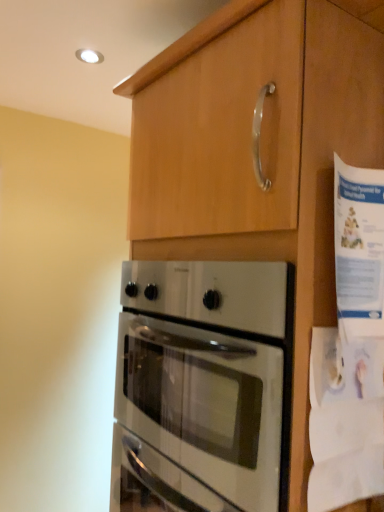
This screenshot has width=384, height=512. In order to click on white paper at right in this screenshot , I will do `click(351, 352)`.

This screenshot has height=512, width=384. What do you see at coordinates (261, 152) in the screenshot?
I see `matte wood cabinet at upper center` at bounding box center [261, 152].

This screenshot has width=384, height=512. What do you see at coordinates (211, 371) in the screenshot?
I see `satin silver oven at center` at bounding box center [211, 371].

What are the coordinates of `white paper at right` in the screenshot? It's located at (351, 352).

Does satin silver oven at center have a lesser height compared to matte wood cabinet at upper center?

Yes, satin silver oven at center is shorter than matte wood cabinet at upper center.

Does satin silver oven at center have a lesser width compared to matte wood cabinet at upper center?

Incorrect, the width of satin silver oven at center is not less than that of matte wood cabinet at upper center.

From a real-world perspective, who is located higher, satin silver oven at center or matte wood cabinet at upper center?

matte wood cabinet at upper center.

From a real-world perspective, is white paper at right on top of satin silver oven at center?

Correct, in the physical world, white paper at right is higher than satin silver oven at center.

Considering the positions of objects white paper at right and satin silver oven at center in the image provided, who is more to the left, white paper at right or satin silver oven at center?

Positioned to the left is satin silver oven at center.

In the scene shown: Does white paper at right turn towards satin silver oven at center?

No, white paper at right is not facing towards satin silver oven at center.

Looking at this image, considering the sizes of objects matte wood cabinet at upper center and white paper at right in the image provided, who is taller, matte wood cabinet at upper center or white paper at right?

Standing taller between the two is matte wood cabinet at upper center.

Is matte wood cabinet at upper center to the left of white paper at right from the viewer's perspective?

Correct, you'll find matte wood cabinet at upper center to the left of white paper at right.

Is matte wood cabinet at upper center far away from white paper at right?

No, matte wood cabinet at upper center is in close proximity to white paper at right.

How much distance is there between matte wood cabinet at upper center and white paper at right?

A distance of 6.99 inches exists between matte wood cabinet at upper center and white paper at right.

Is white paper at right placed right next to matte wood cabinet at upper center?

No, white paper at right is not beside matte wood cabinet at upper center.

Consider the image. In terms of width, does white paper at right look wider or thinner when compared to matte wood cabinet at upper center?

Clearly, white paper at right has less width compared to matte wood cabinet at upper center.

From the image's perspective, does white paper at right appear higher than matte wood cabinet at upper center?

Indeed, from the image's perspective, white paper at right is shown above matte wood cabinet at upper center.

Who is smaller, matte wood cabinet at upper center or satin silver oven at center?

satin silver oven at center.

Consider the image. In the image, is matte wood cabinet at upper center on the left side or the right side of satin silver oven at center?

matte wood cabinet at upper center is positioned on satin silver oven at center's right side.

The height and width of the screenshot is (512, 384). Find the location of `cabinetry on the right side of satin silver oven at center`. cabinetry on the right side of satin silver oven at center is located at coordinates (261, 152).

From a real-world perspective, does matte wood cabinet at upper center sit lower than satin silver oven at center?

Actually, matte wood cabinet at upper center is physically above satin silver oven at center in the real world.

Which is more to the left, satin silver oven at center or white paper at right?

satin silver oven at center is more to the left.

From the image's perspective, which is above, satin silver oven at center or white paper at right?

white paper at right appears higher in the image.

Is satin silver oven at center thinner than white paper at right?

Incorrect, the width of satin silver oven at center is not less than that of white paper at right.

This screenshot has height=512, width=384. Identify the location of cabinetry on the right of satin silver oven at center. (261, 152).

Image resolution: width=384 pixels, height=512 pixels. What are the coordinates of `oven in front of the white paper at right` in the screenshot? It's located at (211, 371).

From the image, which object appears to be nearer to white paper at right, satin silver oven at center or matte wood cabinet at upper center?

matte wood cabinet at upper center is positioned closer to the anchor white paper at right.

Considering their positions, is white paper at right positioned closer to matte wood cabinet at upper center than satin silver oven at center?

The object closer to matte wood cabinet at upper center is white paper at right.

From the image, which object appears to be farther from satin silver oven at center, white paper at right or matte wood cabinet at upper center?

Based on the image, white paper at right appears to be further to satin silver oven at center.

From the image, which object appears to be farther from white paper at right, matte wood cabinet at upper center or satin silver oven at center?

Based on the image, satin silver oven at center appears to be further to white paper at right.

From the image, which object appears to be farther from matte wood cabinet at upper center, satin silver oven at center or white paper at right?

satin silver oven at center is further to matte wood cabinet at upper center.

Looking at this image, considering their positions, is matte wood cabinet at upper center positioned further to satin silver oven at center than white paper at right?

Based on the image, white paper at right appears to be further to satin silver oven at center.

You are a GUI agent. You are given a task and a screenshot of the screen. Output one action in this format:
    pyautogui.click(x=<x>, y=<y>)
    Task: Click on the cabinetry between white paper at right and satin silver oven at center from top to bottom
    
    Given the screenshot: What is the action you would take?
    pyautogui.click(x=261, y=152)